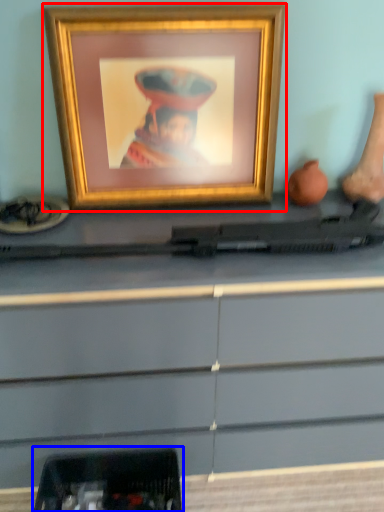
Question: Which object is further to the camera taking this photo, picture frame (highlighted by a red box) or equipment (highlighted by a blue box)?

Choices:
 (A) picture frame
 (B) equipment

Answer: (B)